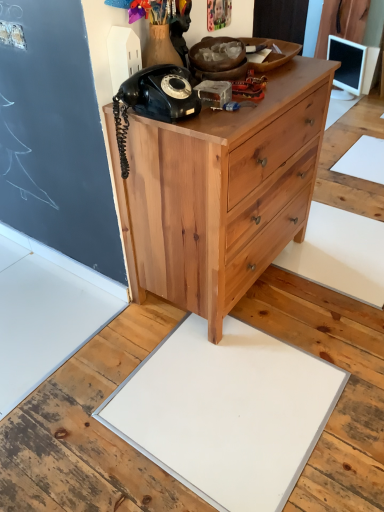
Where is `white glossy monitor at upper right`? white glossy monitor at upper right is located at coordinates (347, 66).

What is the approximate height of natural wood chest of drawers at center?

natural wood chest of drawers at center is 31.80 inches tall.

What do you see at coordinates (221, 192) in the screenshot? I see `natural wood chest of drawers at center` at bounding box center [221, 192].

Measure the distance between point (237, 490) and camera.

Point (237, 490) is 3.84 feet away from camera.

This screenshot has width=384, height=512. Identify the location of white glossy monitor at upper right. (347, 66).

Is white matte slate at center oriented away from black matte rotary phone at upper left?

That's not correct — white matte slate at center is not looking away from black matte rotary phone at upper left.

Can you confirm if white matte slate at center is shorter than black matte rotary phone at upper left?

Yes, white matte slate at center is shorter than black matte rotary phone at upper left.

From a real-world perspective, is white matte slate at center positioned over black matte rotary phone at upper left based on gravity?

Incorrect, from a real-world perspective, white matte slate at center is lower than black matte rotary phone at upper left.

Which is behind, natural wood chest of drawers at center or black matte rotary phone at upper left?

natural wood chest of drawers at center is more distant.

Considering the sizes of natural wood chest of drawers at center and black matte rotary phone at upper left in the image, is natural wood chest of drawers at center bigger or smaller than black matte rotary phone at upper left?

Clearly, natural wood chest of drawers at center is larger in size than black matte rotary phone at upper left.

In terms of width, does natural wood chest of drawers at center look wider or thinner when compared to black matte rotary phone at upper left?

natural wood chest of drawers at center is wider than black matte rotary phone at upper left.

Is black matte rotary phone at upper left surrounded by natural wood chest of drawers at center?

Indeed, black matte rotary phone at upper left is located within natural wood chest of drawers at center.

Is black matte rotary phone at upper left not close to natural wood chest of drawers at center?

No, black matte rotary phone at upper left is not far away from natural wood chest of drawers at center.

Is black matte rotary phone at upper left closer to the viewer compared to natural wood chest of drawers at center?

Yes, black matte rotary phone at upper left is closer to the camera.

Is point (170, 74) less distant than point (176, 257)?

Yes, it is in front of point (176, 257).

In order to click on chest of drawers on the right of black matte rotary phone at upper left in this screenshot , I will do `click(221, 192)`.

Which of these two, white matte slate at center or natural wood chest of drawers at center, is thinner?

With smaller width is natural wood chest of drawers at center.

Is white matte slate at center smaller than natural wood chest of drawers at center?

Yes, white matte slate at center is smaller than natural wood chest of drawers at center.

Consider the image. Choose the correct answer: Is white matte slate at center inside natural wood chest of drawers at center or outside it?

white matte slate at center is not inside natural wood chest of drawers at center, it's outside.

Based on the photo, from a real-world perspective, is black matte rotary phone at upper left over white glossy monitor at upper right?

Yes, from a real-world perspective, black matte rotary phone at upper left is above white glossy monitor at upper right.

Consider the image. Can you confirm if black matte rotary phone at upper left is smaller than white glossy monitor at upper right?

Indeed, black matte rotary phone at upper left has a smaller size compared to white glossy monitor at upper right.

Can you confirm if black matte rotary phone at upper left is thinner than white glossy monitor at upper right?

No, black matte rotary phone at upper left is not thinner than white glossy monitor at upper right.

Is black matte rotary phone at upper left wider than white matte slate at center?

No.

Is black matte rotary phone at upper left inside the boundaries of white matte slate at center, or outside?

black matte rotary phone at upper left exists outside the volume of white matte slate at center.

Looking at the image, does black matte rotary phone at upper left seem bigger or smaller compared to white matte slate at center?

black matte rotary phone at upper left is smaller than white matte slate at center.

Is black matte rotary phone at upper left with white matte slate at center?

black matte rotary phone at upper left and white matte slate at center are not in contact.

In the scene shown: From the image's perspective, between natural wood chest of drawers at center and white glossy monitor at upper right, who is located below?

From the image's view, natural wood chest of drawers at center is below.

Would you say natural wood chest of drawers at center is a long distance from white glossy monitor at upper right?

natural wood chest of drawers at center is far away from white glossy monitor at upper right.

Consider the image. Can you confirm if natural wood chest of drawers at center is bigger than white glossy monitor at upper right?

Correct, natural wood chest of drawers at center is larger in size than white glossy monitor at upper right.

At what (x,y) coordinates should I click in order to perform the action: click on corded phone above the white matte slate at center (from a real-world perspective). Please return your answer as a coordinate pair (x, y). Image resolution: width=384 pixels, height=512 pixels. Looking at the image, I should click on (154, 101).

This screenshot has height=512, width=384. I want to click on chest of drawers on the right of black matte rotary phone at upper left, so click(x=221, y=192).

Which object lies nearer to the anchor point white matte slate at center, natural wood chest of drawers at center or white glossy monitor at upper right?

natural wood chest of drawers at center is positioned closer to the anchor white matte slate at center.

Estimate the real-world distances between objects in this image. Which object is further from white matte slate at center, black matte rotary phone at upper left or natural wood chest of drawers at center?

Among the two, black matte rotary phone at upper left is located further to white matte slate at center.

When comparing their distances from white glossy monitor at upper right, does white matte slate at center or black matte rotary phone at upper left seem further?

Among the two, white matte slate at center is located further to white glossy monitor at upper right.

Which object lies further to the anchor point black matte rotary phone at upper left, natural wood chest of drawers at center or white glossy monitor at upper right?

white glossy monitor at upper right.

From the image, which object appears to be farther from black matte rotary phone at upper left, white glossy monitor at upper right or natural wood chest of drawers at center?

white glossy monitor at upper right.

Based on their spatial positions, is white glossy monitor at upper right or natural wood chest of drawers at center further from white matte slate at center?

white glossy monitor at upper right lies further to white matte slate at center than the other object.

When comparing their distances from white glossy monitor at upper right, does black matte rotary phone at upper left or natural wood chest of drawers at center seem closer?

The object closer to white glossy monitor at upper right is natural wood chest of drawers at center.

Considering their positions, is white matte slate at center positioned closer to natural wood chest of drawers at center than white glossy monitor at upper right?

white matte slate at center lies closer to natural wood chest of drawers at center than the other object.

This screenshot has width=384, height=512. In order to click on chest of drawers between white matte slate at center and white glossy monitor at upper right along the z-axis in this screenshot , I will do (x=221, y=192).

Locate an element on the screen. This screenshot has height=512, width=384. corded phone positioned between white matte slate at center and white glossy monitor at upper right from near to far is located at coordinates (154, 101).

What are the coordinates of `the chest of drawers located between black matte rotary phone at upper left and white glossy monitor at upper right in the depth direction` in the screenshot? It's located at (221, 192).

Identify the location of chest of drawers between black matte rotary phone at upper left and white matte slate at center in the up-down direction. This screenshot has width=384, height=512. (221, 192).